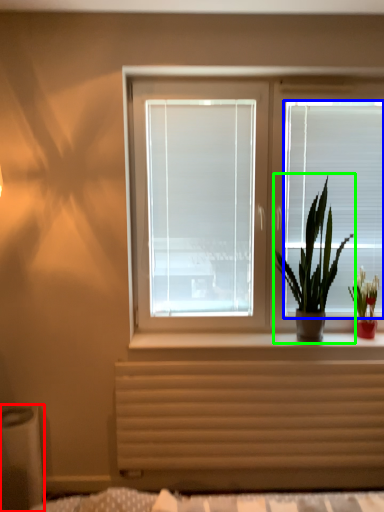
Question: Which object is positioned closest to window box (highlighted by a red box)? Select from blind (highlighted by a blue box) and houseplant (highlighted by a green box).

Choices:
 (A) blind
 (B) houseplant

Answer: (B)